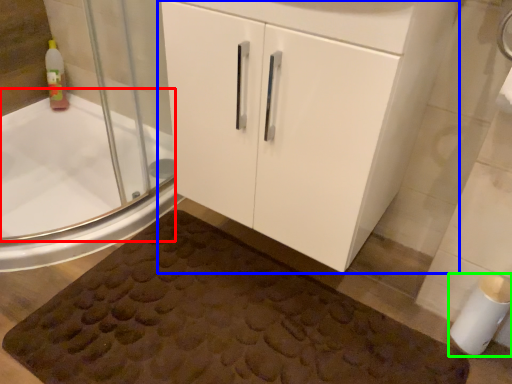
Question: Which object is the farthest from bath (highlighted by a red box)? Choose among these: bathroom cabinet (highlighted by a blue box) or toilet paper (highlighted by a green box).

Choices:
 (A) bathroom cabinet
 (B) toilet paper

Answer: (B)